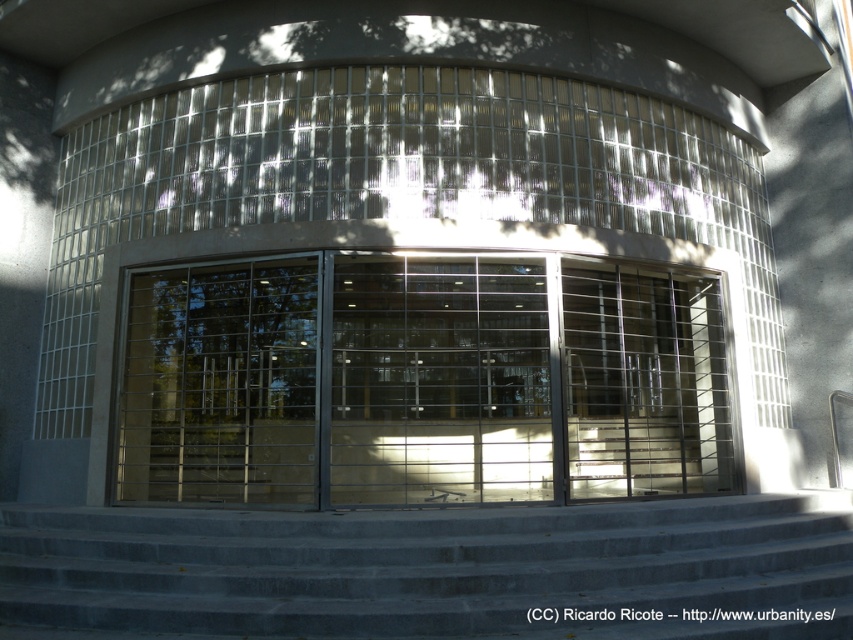
Between gray concrete stairs at lower center and transparent glass door at center, which one has more height?

transparent glass door at center

Is gray concrete stairs at lower center bigger than transparent glass door at center?

Incorrect, gray concrete stairs at lower center is not larger than transparent glass door at center.

Image resolution: width=853 pixels, height=640 pixels. In order to click on gray concrete stairs at lower center in this screenshot , I will do `click(432, 570)`.

Is clear glass door at center further to camera compared to gray concrete stairs at lower center?

Yes.

Does point (519, 376) come closer to viewer compared to point (749, 621)?

No, it is not.

What are the coordinates of `clear glass door at center` in the screenshot? It's located at (421, 381).

Does clear glass door at center appear on the left side of transparent glass door at center?

No, clear glass door at center is not to the left of transparent glass door at center.

Which is more to the right, clear glass door at center or transparent glass door at center?

Positioned to the right is clear glass door at center.

This screenshot has height=640, width=853. Describe the element at coordinates (421, 381) in the screenshot. I see `clear glass door at center` at that location.

At what (x,y) coordinates should I click in order to perform the action: click on clear glass door at center. Please return your answer as a coordinate pair (x, y). This screenshot has height=640, width=853. Looking at the image, I should click on (421, 381).